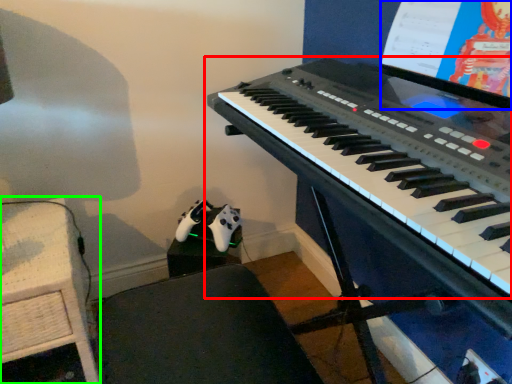
Question: Considering the real-world distances, which object is farthest from musical keyboard (highlighted by a red box)? computer screen (highlighted by a blue box) or table (highlighted by a green box)?

Choices:
 (A) computer screen
 (B) table

Answer: (B)